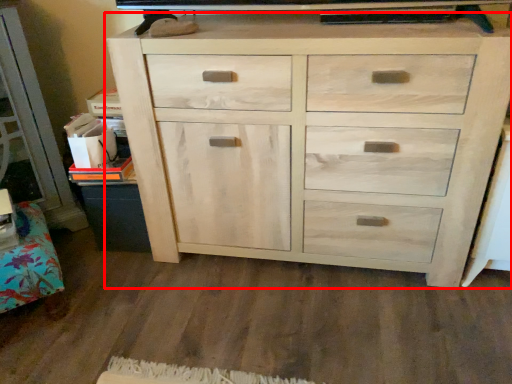
Question: Considering the relative positions of chest of drawers (annotated by the red box) and cabinetry in the image provided, where is chest of drawers (annotated by the red box) located with respect to the staircase?

Choices:
 (A) right
 (B) left

Answer: (A)